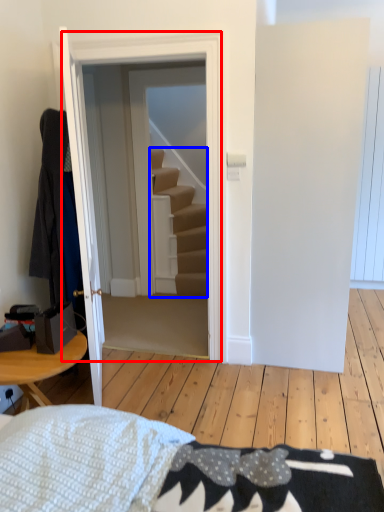
Question: Among these objects, which one is farthest to the camera, door (highlighted by a red box) or stairs (highlighted by a blue box)?

Choices:
 (A) door
 (B) stairs

Answer: (B)